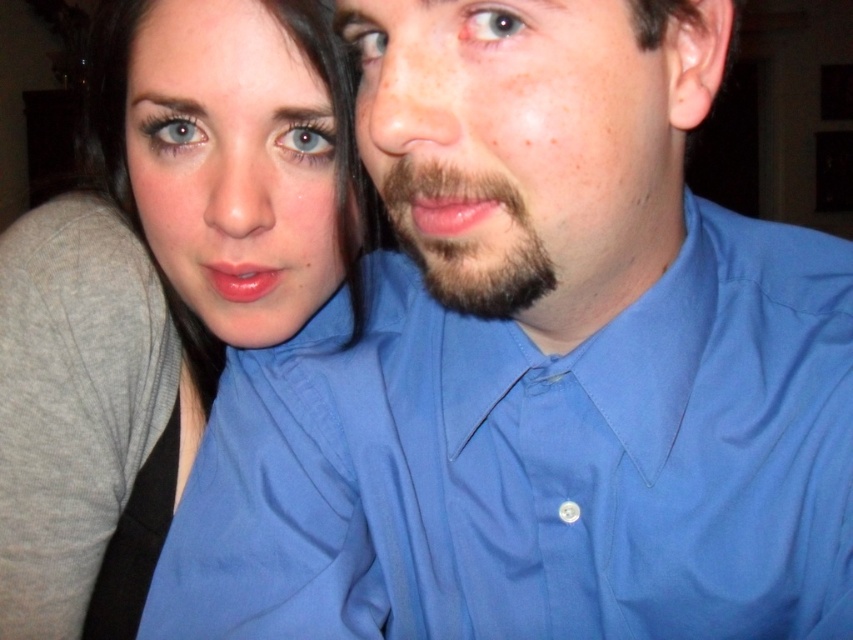
You are a photographer trying to capture a closeup shot of both the matte blue shirt at center and the dark brown fuzzy beard at center. Given that your camera has a depth of field that can sharply focus on objects within a 12 inches range, will both objects be in focus simultaneously?

The matte blue shirt at center and dark brown fuzzy beard at center are 12.58 inches apart from each other. Since the distance between them exceeds the camera sensor depth of field range of 12 inches, both objects cannot be in focus at the same time.

You are taking a photo of two people standing in front of you. You notice the matte blue shirt at center and the dark brown fuzzy beard at center. Which object is closer to you?

The matte blue shirt at center is closer to you because the dark brown fuzzy beard at center is behind it.

You are a photographer trying to capture the man in the blue button up shirt at center. The camera can only focus on objects within a 0.1 unit radius around the point marked at coordinate (537, 465). Will the blue button up shirt at center be in focus?

The point (537, 465) marks the blue smooth shirt at center, so yes, the blue button up shirt at center will be in focus as the camera focuses on that exact point.